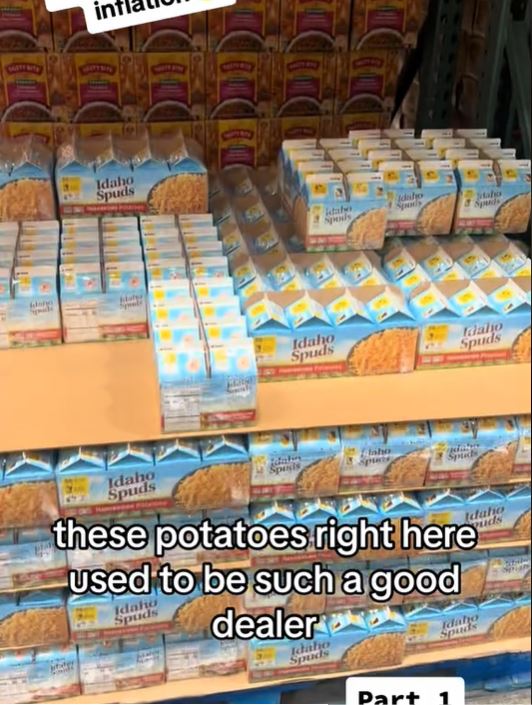
At what (x,y) coordinates should I click in order to perform the action: click on top shelf. Please return your answer as a coordinate pair (x, y). Looking at the image, I should click on (104, 392).